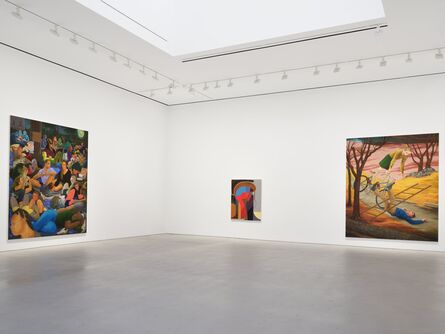
Find the location of a particular element. This screenshot has height=334, width=445. art gallery is located at coordinates (284, 175).